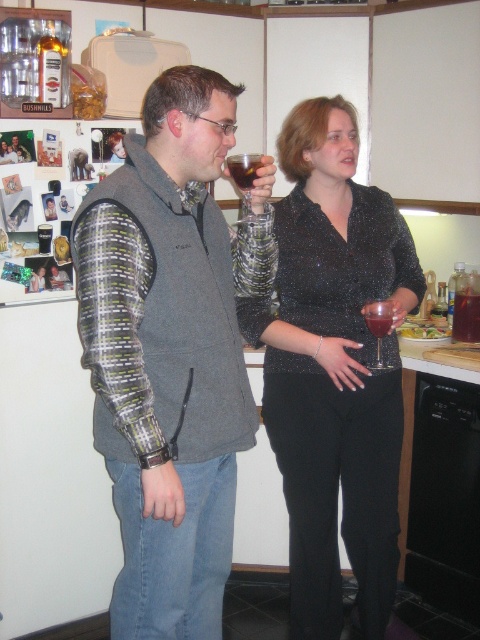
You are a bartender who needs to place a new drink order on the table between the sparkly black blouse at center and the dark red liquid at center. Since you want the drink to be centered, where should you place it?

The dark red liquid at center is on the right side of the sparkly black blouse at center, so placing the new drink order between them would require positioning it to the right of the sparkly black blouse at center and to the left of the dark red liquid at center to keep it centered.

You are a photographer setting up a shoot in the kitchen scene. You need to position a spotlight to the right of both the gray fleece vest at center and the sparkly black blouse at center. Is this possible given their positions?

The gray fleece vest at center is to the left of the sparkly black blouse at center. Since the spotlight needs to be placed to the right of both, it is possible as the rightmost object is the sparkly black blouse at center. Position the spotlight to the right of the sparkly black blouse at center to satisfy both requirements.

You are a bartender trying to place a new drink order. You see the point at coordinates point (x=169, y=355) which is on the gray fleece vest at center. Where should you place the drink so it is closest to the gray fleece vest at center without touching it?

The drink should be placed as close as possible to the point (x=169, y=355) on the gray fleece vest at center, ensuring it does not make contact with the vest.